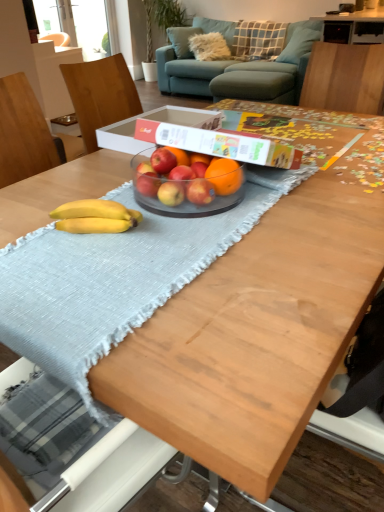
The width and height of the screenshot is (384, 512). What are the coordinates of `free region on the left part of orange matte at center` in the screenshot? It's located at (150, 204).